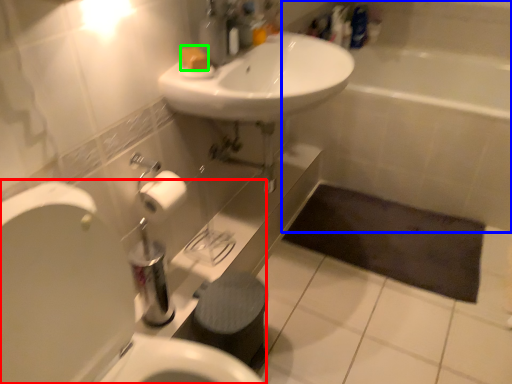
Question: Estimate the real-world distances between objects in this image. Which object is farther from toilet (highlighted by a red box), bath (highlighted by a blue box) or soap (highlighted by a green box)?

Choices:
 (A) bath
 (B) soap

Answer: (A)